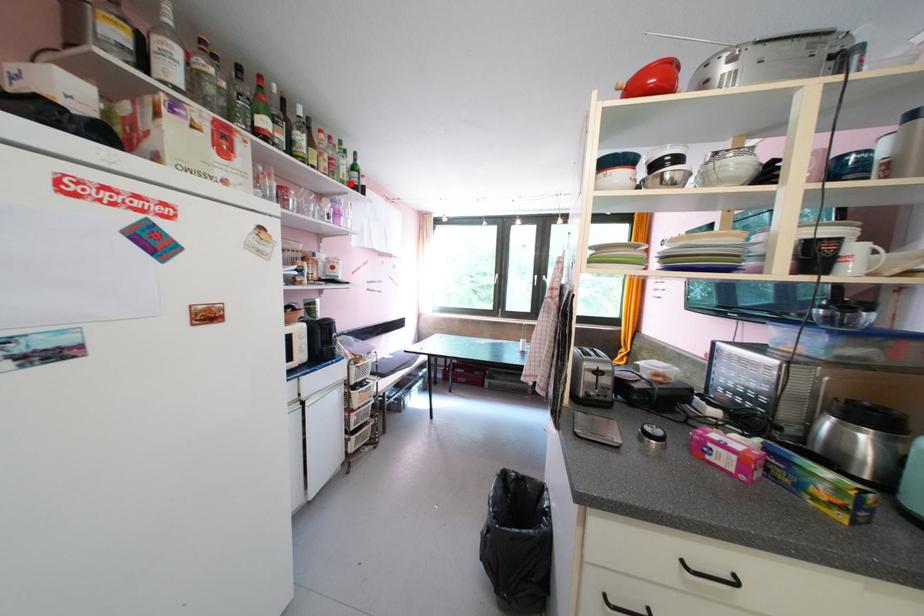
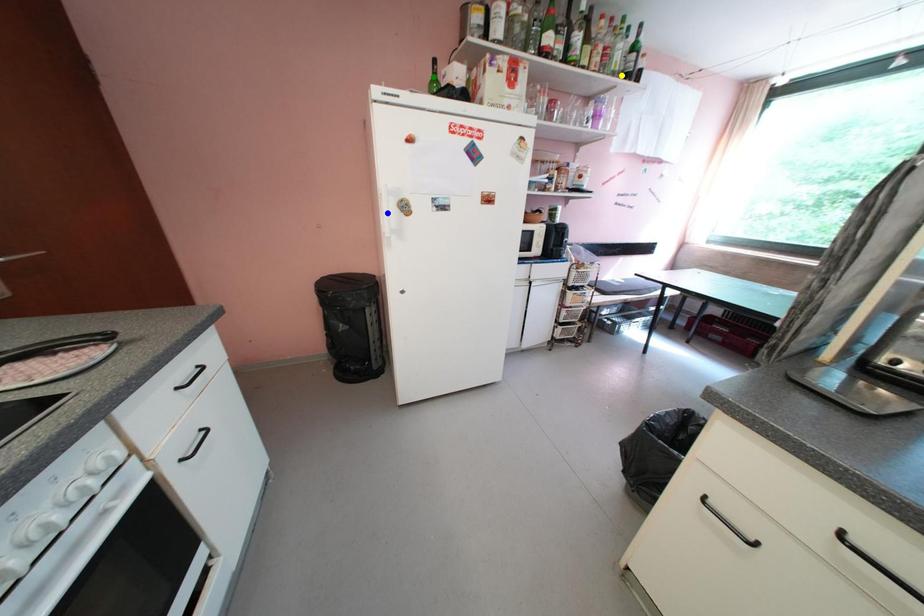
Question: I am providing you with two images of the same scene from different viewpoints. A red point is marked on the first image. You are given multiple points on the second image. Can you choose the point in image 2 that corresponds to the point in image 1?

Choices:
 (A) green point
 (B) blue point
 (C) yellow point

Answer: (C)